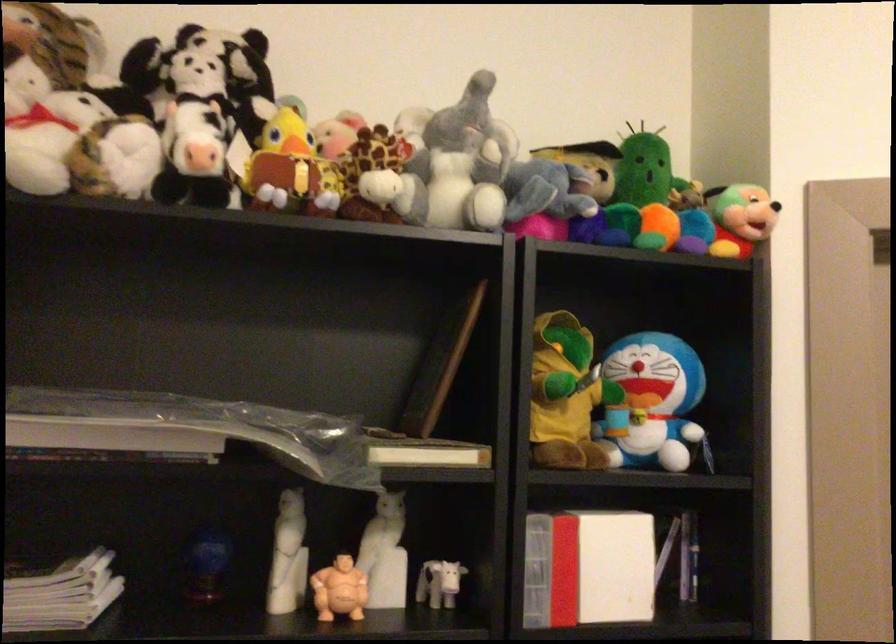
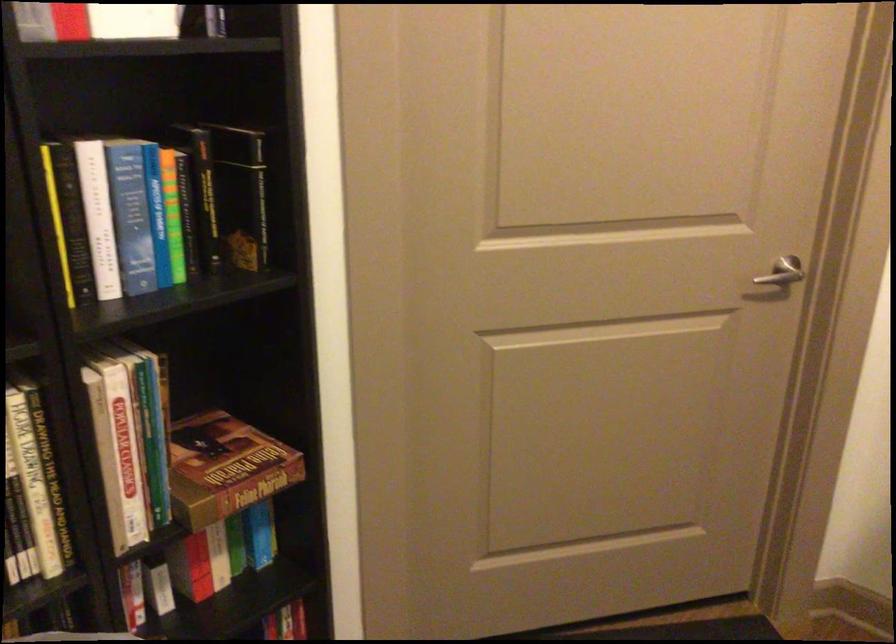
How did the camera likely rotate?

The camera rotated toward right-down.